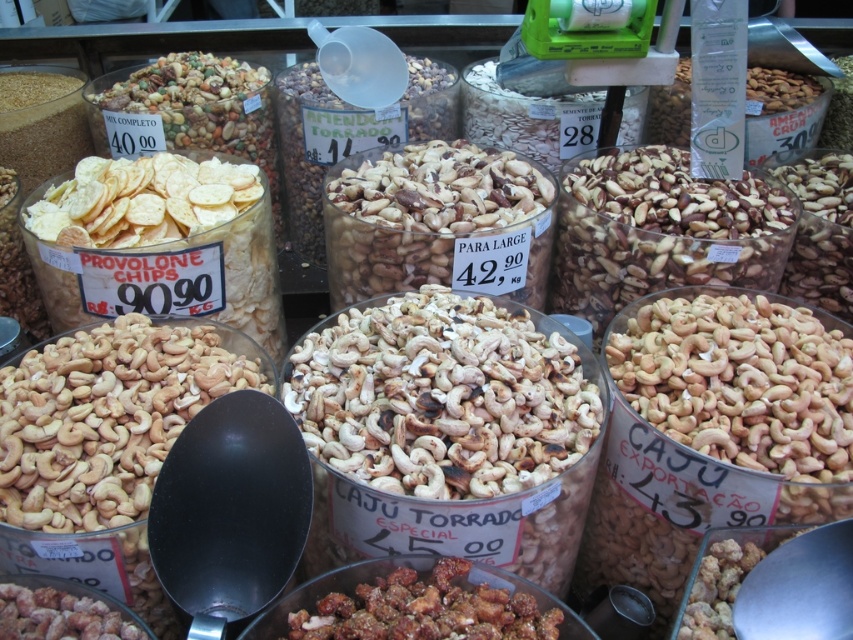
Is crispy brown nuts at center closer to camera compared to brown matte cashew nuts at lower left?

Yes.

Who is taller, crispy brown nuts at center or brown matte cashew nuts at lower left?

crispy brown nuts at center

Where is `crispy brown nuts at center`? The image size is (853, 640). crispy brown nuts at center is located at coordinates (425, 609).